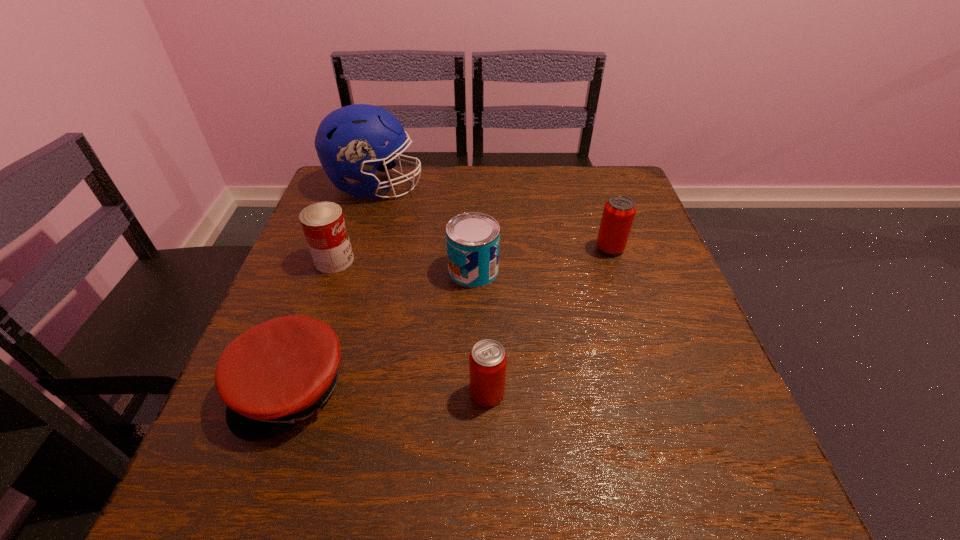
Locate an element on the screen. object that is positioned at the far edge is located at coordinates (350, 141).

This screenshot has width=960, height=540. What are the coordinates of `football helmet present at the left edge` in the screenshot? It's located at (350, 141).

You are a GUI agent. You are given a task and a screenshot of the screen. Output one action in this format:
    pyautogui.click(x=<x>, y=<y>)
    Task: Click on the can that is at the left edge
    This screenshot has width=960, height=540.
    Given the screenshot: What is the action you would take?
    pyautogui.click(x=323, y=224)

Where is `cap positioned at the left edge`? cap positioned at the left edge is located at coordinates (280, 372).

Where is `object at the right edge`? object at the right edge is located at coordinates pos(619,211).

This screenshot has width=960, height=540. I want to click on object that is positioned at the far left corner, so click(350, 141).

The image size is (960, 540). In the image, there is a desktop. Find the location of `vacant region at the far edge`. vacant region at the far edge is located at coordinates (457, 211).

Locate an element on the screen. The height and width of the screenshot is (540, 960). free spot at the near edge of the desktop is located at coordinates (638, 503).

Find the location of `vacant space at the left edge of the desktop`. vacant space at the left edge of the desktop is located at coordinates (287, 270).

You are a GUI agent. You are given a task and a screenshot of the screen. Output one action in this format:
    pyautogui.click(x=<x>, y=<y>)
    Task: Click on the vacant space at the right edge of the desktop
    The width and height of the screenshot is (960, 540).
    Given the screenshot: What is the action you would take?
    pos(610,320)